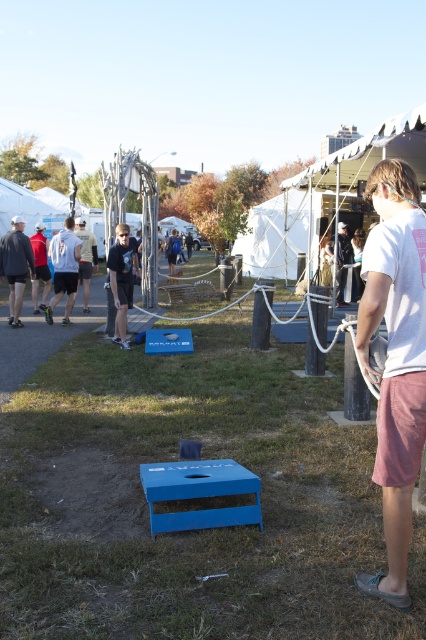
You are standing at the blue cornhole board and want to walk towards the point marked as point (36, 266). However, there is an obstacle at point marked as point (135, 257). Will you encounter the obstacle before reaching your destination?

A: Yes, you will encounter the obstacle at point (135, 257) before reaching the destination at point (36, 266) because point (135, 257) is in front of point (36, 266).

You are standing in front of the blue cornhole board and want to place a marker at two specific points. The first point is at coordinates point [164,397] and the second point is at coordinates point [336,240]. Which of these two points is closer to you?

Point [164,397] is closer to the viewer than point [336,240].